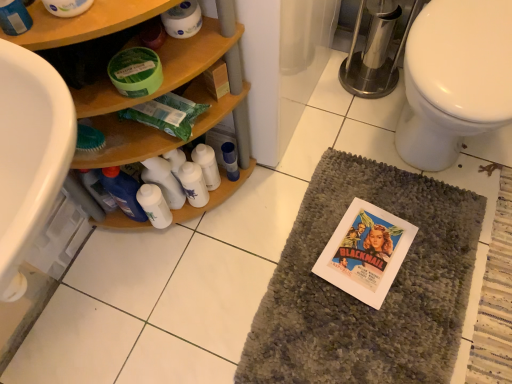
Where is `white paper comic book at center`? This screenshot has width=512, height=384. white paper comic book at center is located at coordinates (365, 252).

What do you see at coordinates (365, 252) in the screenshot?
I see `white paper comic book at center` at bounding box center [365, 252].

Measure the distance between white glossy bottles at center, the second toiletry in the left-to-right sequence, and camera.

The depth of white glossy bottles at center, the second toiletry in the left-to-right sequence, is 3.88 feet.

Measure the distance between point (194, 175) and camera.

Point (194, 175) and camera are 1.20 meters apart from each other.

The image size is (512, 384). What do you see at coordinates (154, 205) in the screenshot?
I see `white matte lotion at center, marked as the 2th toiletry in a right-to-left arrangement` at bounding box center [154, 205].

The image size is (512, 384). Identify the location of white matte toilet paper at upper center. (183, 19).

In the image, is white matte toilet paper at upper center positioned in front of or behind white plastic bottles at center, the 2th bottle in the right-to-left sequence?

In the image, white matte toilet paper at upper center appears in front of white plastic bottles at center, the 2th bottle in the right-to-left sequence.

From the image's perspective, which is above, white matte toilet paper at upper center or white plastic bottles at center, positioned as the 1th bottle in left-to-right order?

white matte toilet paper at upper center.

The height and width of the screenshot is (384, 512). There is a white plastic bottles at center, positioned as the 1th bottle in left-to-right order. Find the location of `toilet paper above it (from a real-world perspective)`. toilet paper above it (from a real-world perspective) is located at coordinates (183, 19).

Based on their positions, is woodenmaterial/texturebathroom cabinet at left located to the left or right of white plastic bottles at center, positioned as the 1th bottle in left-to-right order?

From the image, it's evident that woodenmaterial/texturebathroom cabinet at left is to the left of white plastic bottles at center, positioned as the 1th bottle in left-to-right order.

Is woodenmaterial/texturebathroom cabinet at left outside of white plastic bottles at center, positioned as the 1th bottle in left-to-right order?

Yes, woodenmaterial/texturebathroom cabinet at left is outside of white plastic bottles at center, positioned as the 1th bottle in left-to-right order.

From the image's perspective, is woodenmaterial/texturebathroom cabinet at left above or below white plastic bottles at center, the 2th bottle in the right-to-left sequence?

Clearly, from the image's perspective, woodenmaterial/texturebathroom cabinet at left is above white plastic bottles at center, the 2th bottle in the right-to-left sequence.

Locate an element on the screen. Image resolution: width=512 pixels, height=384 pixels. the 1st bottle behind the woodenmaterial/texturebathroom cabinet at left, counting from the anchor's position is located at coordinates [207, 165].

Between white matte lotion at center, marked as the 2th toiletry in a right-to-left arrangement, and white plastic bottles at center, the 2th bottle in the right-to-left sequence, which one has larger width?

white plastic bottles at center, the 2th bottle in the right-to-left sequence.

From a real-world perspective, is white matte lotion at center, marked as the 1th toiletry in a left-to-right arrangement, physically below white plastic bottles at center, the 2th bottle in the right-to-left sequence?

Incorrect, from a real-world perspective, white matte lotion at center, marked as the 1th toiletry in a left-to-right arrangement, is higher than white plastic bottles at center, the 2th bottle in the right-to-left sequence.

Considering the positions of points (164, 225) and (209, 171), is point (164, 225) farther from camera compared to point (209, 171)?

Yes.

Measure the distance between gray textured bath mat at center and white glossy toilet at right.

gray textured bath mat at center and white glossy toilet at right are 18.23 inches apart.

The image size is (512, 384). I want to click on toilet that is on the right side of gray textured bath mat at center, so click(x=454, y=79).

Can you confirm if gray textured bath mat at center is smaller than white glossy toilet at right?

Correct, gray textured bath mat at center occupies less space than white glossy toilet at right.

From the image's perspective, does white matte toilet paper at upper center appear lower than gray textured bath mat at center?

No.

From a real-world perspective, relative to gray textured bath mat at center, is white matte toilet paper at upper center vertically above or below?

In terms of real-world spatial position, white matte toilet paper at upper center is above gray textured bath mat at center.

Can you confirm if white matte toilet paper at upper center is shorter than gray textured bath mat at center?

No.

Is white plastic bottles at center, the 2th bottle in the right-to-left sequence, positioned with its back to white matte toilet paper at upper center?

That's not correct — white plastic bottles at center, the 2th bottle in the right-to-left sequence, is not looking away from white matte toilet paper at upper center.

From the picture: From a real-world perspective, is white plastic bottles at center, the 2th bottle in the right-to-left sequence, positioned above or below white matte toilet paper at upper center?

A: white plastic bottles at center, the 2th bottle in the right-to-left sequence, is below white matte toilet paper at upper center.

Considering their positions, is white plastic bottles at center, positioned as the 1th bottle in left-to-right order, located in front of or behind white matte toilet paper at upper center?

Clearly, white plastic bottles at center, positioned as the 1th bottle in left-to-right order, is behind white matte toilet paper at upper center.

Choose the correct answer: Is white plastic bottles at center, positioned as the 1th bottle in left-to-right order, inside white matte toilet paper at upper center or outside it?

white plastic bottles at center, positioned as the 1th bottle in left-to-right order, is not inside white matte toilet paper at upper center, it's outside.

Is white plastic bottles at center, positioned as the 1th bottle in left-to-right order, not near woodenmaterial/texturebathroom cabinet at left?

white plastic bottles at center, positioned as the 1th bottle in left-to-right order, is actually quite close to woodenmaterial/texturebathroom cabinet at left.

Consider the image. Considering the sizes of objects white plastic bottles at center, the 2th bottle in the right-to-left sequence, and woodenmaterial/texturebathroom cabinet at left in the image provided, who is wider, white plastic bottles at center, the 2th bottle in the right-to-left sequence, or woodenmaterial/texturebathroom cabinet at left?

woodenmaterial/texturebathroom cabinet at left.

Who is bigger, white plastic bottles at center, the 2th bottle in the right-to-left sequence, or woodenmaterial/texturebathroom cabinet at left?

Bigger between the two is woodenmaterial/texturebathroom cabinet at left.

From a real-world perspective, does white plastic bottles at center, the 2th bottle in the right-to-left sequence, sit lower than woodenmaterial/texturebathroom cabinet at left?

Yes, from a real-world perspective, white plastic bottles at center, the 2th bottle in the right-to-left sequence, is under woodenmaterial/texturebathroom cabinet at left.

The width and height of the screenshot is (512, 384). I want to click on toilet paper that is on the left side of white plastic bottles at center, the 2th bottle in the right-to-left sequence, so click(x=183, y=19).

From the image's perspective, count 2nd bottles downward from the woodenmaterial/texturebathroom cabinet at left and point to it. Please provide its 2D coordinates.

[(207, 165)]

From the picture: Considering their positions, is white matte lotion at center, marked as the 1th toiletry in a left-to-right arrangement, positioned closer to white glossy toilet at right than woodenmaterial/texturebathroom cabinet at left?

The object closer to white glossy toilet at right is woodenmaterial/texturebathroom cabinet at left.

Looking at the image, which one is located closer to white glossy bottles at center, the second toiletry in the left-to-right sequence, white matte lotion at center, marked as the 2th toiletry in a right-to-left arrangement, or white plastic bottles at center, positioned as the 1th bottle in left-to-right order?

white plastic bottles at center, positioned as the 1th bottle in left-to-right order, lies closer to white glossy bottles at center, the second toiletry in the left-to-right sequence, than the other object.

Looking at the image, which one is located further to white matte toilet paper at upper center, blue glossy bottle at center, the second bottle from the left, or gray textured bath mat at center?

Answer: The object further to white matte toilet paper at upper center is gray textured bath mat at center.

Which object lies nearer to the anchor point white paper comic book at center, blue glossy bottle at center, the second bottle from the left, or woodenmaterial/texturebathroom cabinet at left?

Based on the image, blue glossy bottle at center, the second bottle from the left, appears to be nearer to white paper comic book at center.

Considering their positions, is woodenmaterial/texturebathroom cabinet at left positioned further to gray textured bath mat at center than white glossy bottles at center, the second toiletry in the left-to-right sequence?

woodenmaterial/texturebathroom cabinet at left.

From the image, which object appears to be nearer to white paper comic book at center, white plastic bottles at center, positioned as the 1th bottle in left-to-right order, or white glossy bottles at center, the first toiletry positioned from the right?

white plastic bottles at center, positioned as the 1th bottle in left-to-right order.

Looking at the image, which one is located closer to gray textured bath mat at center, white glossy toilet at right or blue glossy bottle at center, the second bottle from the left?

blue glossy bottle at center, the second bottle from the left.

When comparing their distances from woodenmaterial/texturebathroom cabinet at left, does white glossy toilet at right or white plastic bottles at center, positioned as the 1th bottle in left-to-right order, seem further?

white glossy toilet at right lies further to woodenmaterial/texturebathroom cabinet at left than the other object.

You are a GUI agent. You are given a task and a screenshot of the screen. Output one action in this format:
    pyautogui.click(x=<x>, y=<y>)
    Task: Click on the bottle situated between white matte lotion at center, marked as the 1th toiletry in a left-to-right arrangement, and blue glossy bottle at center, the first bottle positioned from the right, from left to right
    The image size is (512, 384).
    Given the screenshot: What is the action you would take?
    click(207, 165)

Find the location of a particular element. The image size is (512, 384). comic book between woodenmaterial/texturebathroom cabinet at left and blue glossy bottle at center, the first bottle positioned from the right, in the front-back direction is located at coordinates (365, 252).

Locate an element on the screen. This screenshot has height=384, width=512. comic book between white glossy bottles at center, the first toiletry positioned from the right, and white glossy toilet at right is located at coordinates (365, 252).

The image size is (512, 384). I want to click on bathroom cabinet between white matte lotion at center, marked as the 2th toiletry in a right-to-left arrangement, and white paper comic book at center from left to right, so click(x=208, y=92).